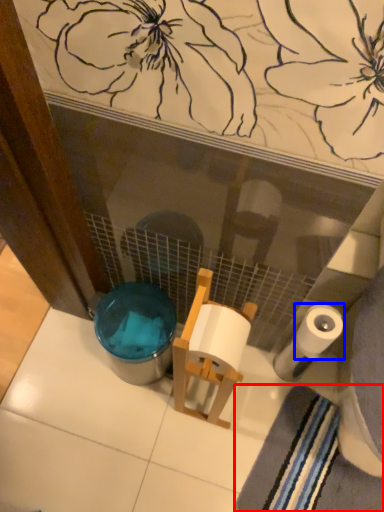
Question: Which point is closer to the camera, bath towel (highlighted by a red box) or toilet paper (highlighted by a blue box)?

Choices:
 (A) bath towel
 (B) toilet paper

Answer: (B)